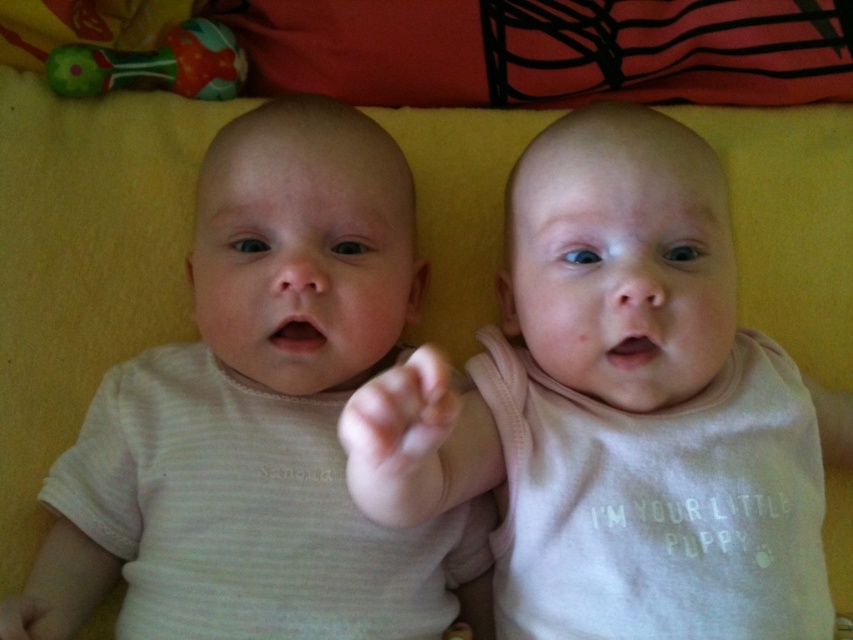
You are a photographer setting up for a baby photoshoot. You have two items in the scene, the pink soft fabric baby at center and the matte plastic rattle at upper left. Which item should you focus on first if you want to capture the larger object in your shot?

The pink soft fabric baby at center is bigger than the matte plastic rattle at upper left, so you should focus on the pink soft fabric baby at center first to capture the larger object.